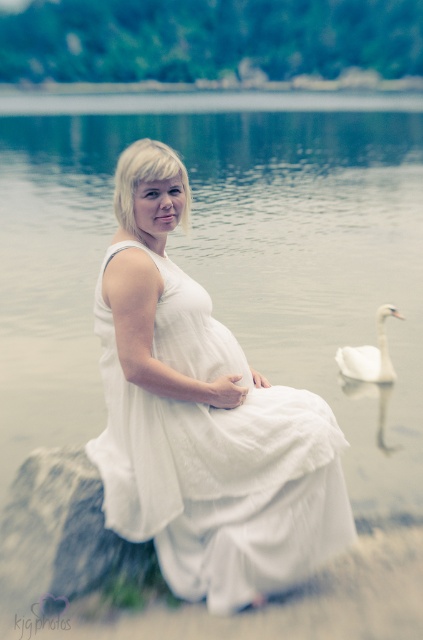
Question: Does clear water at center appear on the right side of white smooth swan at lower right?

Choices:
 (A) yes
 (B) no

Answer: (A)

Question: Which point is closer to the camera taking this photo?

Choices:
 (A) (331, 476)
 (B) (357, 115)

Answer: (A)

Question: Estimate the real-world distances between objects in this image. Which object is farther from the white linen dress at center?

Choices:
 (A) white smooth swan at lower right
 (B) clear water at center

Answer: (B)

Question: In this image, where is clear water at center located relative to white linen dress at center?

Choices:
 (A) left
 (B) right

Answer: (B)

Question: Observing the image, what is the correct spatial positioning of clear water at center in reference to white smooth swan at lower right?

Choices:
 (A) below
 (B) above

Answer: (B)

Question: Which point is farther to the camera?

Choices:
 (A) (392, 310)
 (B) (400, 346)
 (C) (205, 432)

Answer: (B)